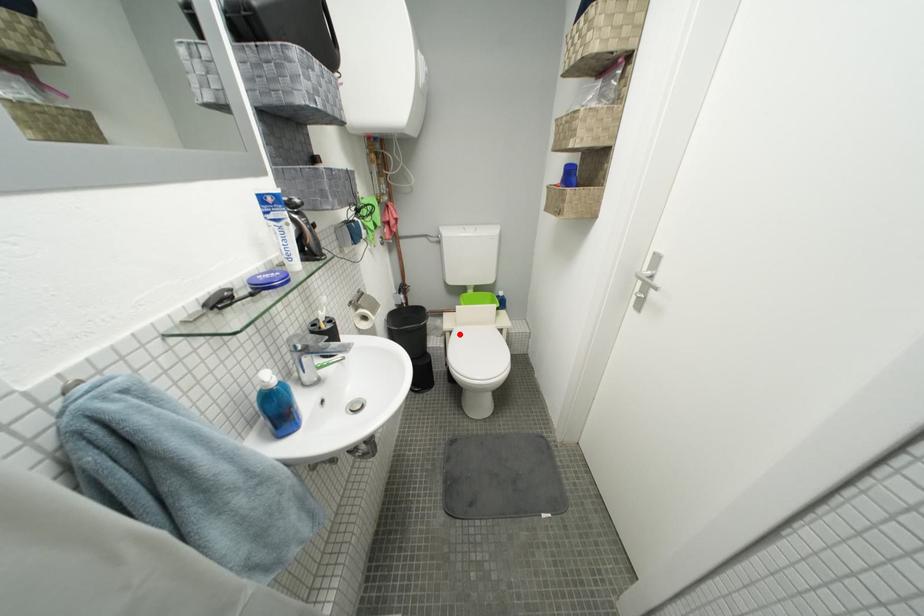
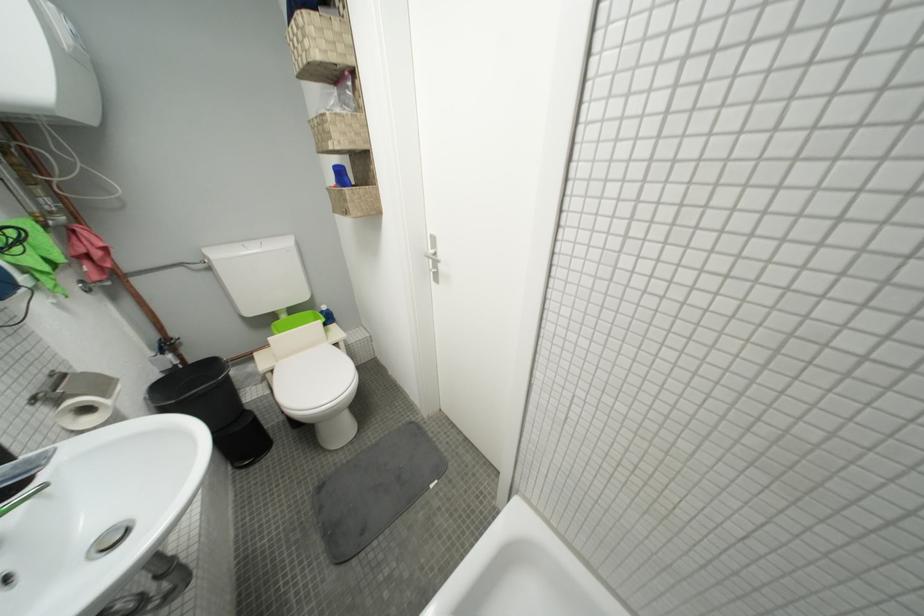
Where in the second image is the point corresponding to the highlighted location from the first image?

(281, 373)